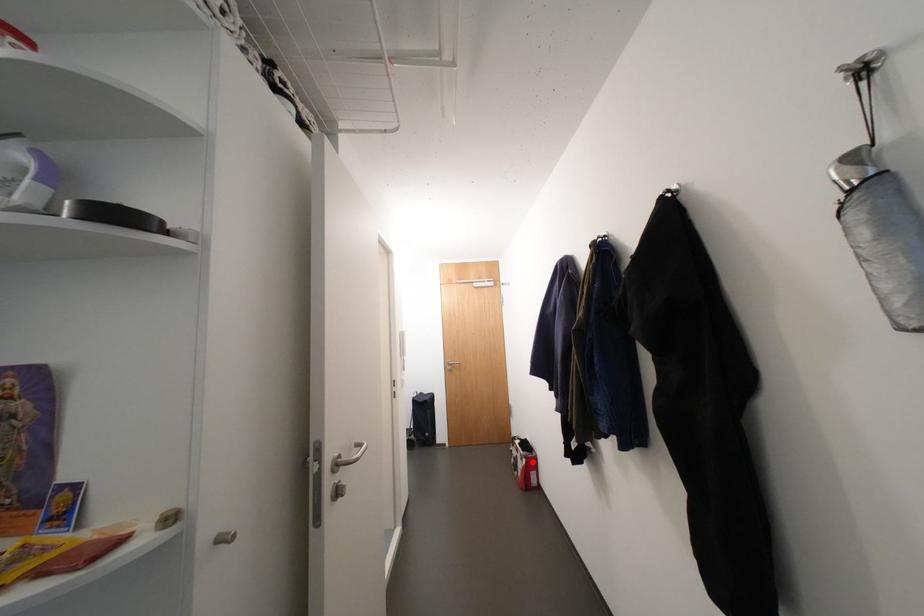
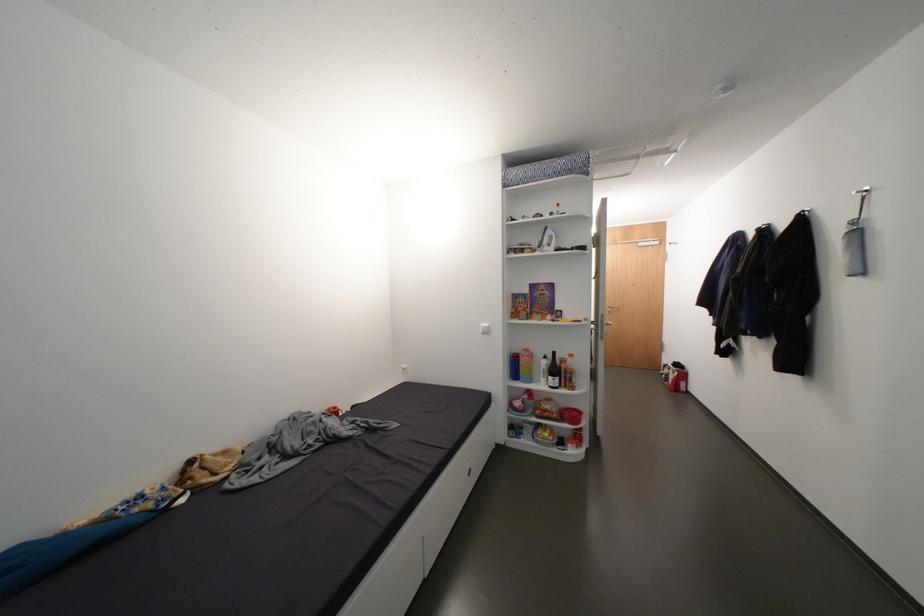
Find the pixel in the second image that matches the highlighted location in the first image.

(684, 374)